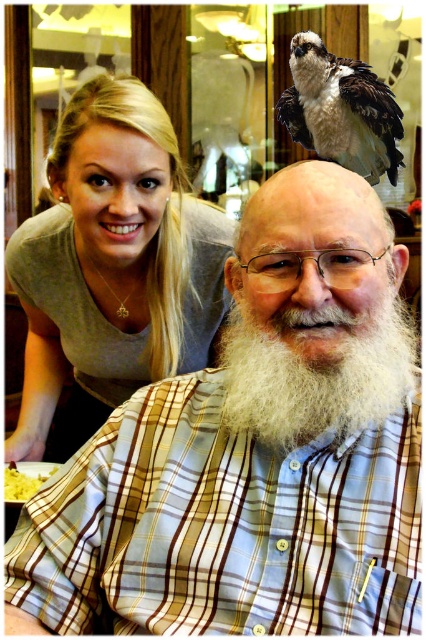
Based on the photo, between plaid shirt at center and brown speckled feathers at upper right, which one appears on the right side from the viewer's perspective?

brown speckled feathers at upper right is more to the right.

Who is taller, plaid shirt at center or brown speckled feathers at upper right?

plaid shirt at center is taller.

Is point (400, 620) in front of point (305, 58)?

Yes, it is.

Identify the location of plaid shirt at center. This screenshot has height=640, width=426. (253, 452).

Between plaid shirt at center and yellow mashed potatoes at lower left, which one appears on the right side from the viewer's perspective?

plaid shirt at center is more to the right.

Which is more to the left, plaid shirt at center or yellow mashed potatoes at lower left?

From the viewer's perspective, yellow mashed potatoes at lower left appears more on the left side.

Where is `plaid shirt at center`? The image size is (426, 640). plaid shirt at center is located at coordinates (253, 452).

Where is `plaid shirt at center`? This screenshot has width=426, height=640. plaid shirt at center is located at coordinates 253,452.

Can you confirm if plaid shirt at center is positioned below white fluffy beard at center?

Yes.

The height and width of the screenshot is (640, 426). In order to click on plaid shirt at center in this screenshot , I will do `click(253, 452)`.

Is point (169, 561) farther from viewer compared to point (261, 392)?

No.

You are a GUI agent. You are given a task and a screenshot of the screen. Output one action in this format:
    pyautogui.click(x=<x>, y=<y>)
    Task: Click on the plaid shirt at center
    Image resolution: width=426 pixels, height=640 pixels.
    Given the screenshot: What is the action you would take?
    pyautogui.click(x=253, y=452)